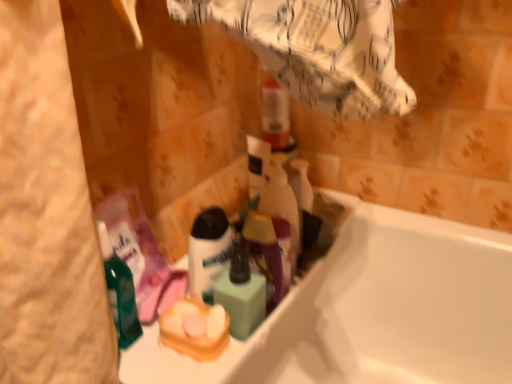
Question: Does green matte mouthwash at center have a larger size compared to translucent purple spray bottle at center?

Choices:
 (A) yes
 (B) no

Answer: (B)

Question: Is green matte mouthwash at center touching translucent purple spray bottle at center?

Choices:
 (A) no
 (B) yes

Answer: (A)

Question: Can you confirm if green matte mouthwash at center is shorter than translucent purple spray bottle at center?

Choices:
 (A) no
 (B) yes

Answer: (B)

Question: Could you tell me if green matte mouthwash at center is turned towards translucent purple spray bottle at center?

Choices:
 (A) no
 (B) yes

Answer: (A)

Question: Is green matte mouthwash at center not within translucent purple spray bottle at center?

Choices:
 (A) no
 (B) yes

Answer: (B)

Question: From a real-world perspective, is yellow sponge at center positioned above or below white matte shaving cream at center?

Choices:
 (A) above
 (B) below

Answer: (B)

Question: Considering the positions of yellow sponge at center and white matte shaving cream at center in the image, is yellow sponge at center bigger or smaller than white matte shaving cream at center?

Choices:
 (A) big
 (B) small

Answer: (B)

Question: From the image's perspective, is yellow sponge at center positioned above or below white matte shaving cream at center?

Choices:
 (A) below
 (B) above

Answer: (A)

Question: Is yellow sponge at center in front of or behind white matte shaving cream at center in the image?

Choices:
 (A) behind
 (B) front

Answer: (B)

Question: Is yellow sponge at center to the left or to the right of white glossy bathtub at lower right in the image?

Choices:
 (A) right
 (B) left

Answer: (B)

Question: Considering the positions of yellow sponge at center and white glossy bathtub at lower right in the image, is yellow sponge at center taller or shorter than white glossy bathtub at lower right?

Choices:
 (A) short
 (B) tall

Answer: (A)

Question: From a real-world perspective, relative to white glossy bathtub at lower right, is yellow sponge at center vertically above or below?

Choices:
 (A) below
 (B) above

Answer: (B)

Question: Is point (181, 299) closer or farther from the camera than point (126, 352)?

Choices:
 (A) closer
 (B) farther

Answer: (B)

Question: In terms of width, does yellow sponge at center look wider or thinner when compared to translucent purple spray bottle at center?

Choices:
 (A) wide
 (B) thin

Answer: (A)

Question: From their relative heights in the image, would you say yellow sponge at center is taller or shorter than translucent purple spray bottle at center?

Choices:
 (A) short
 (B) tall

Answer: (A)